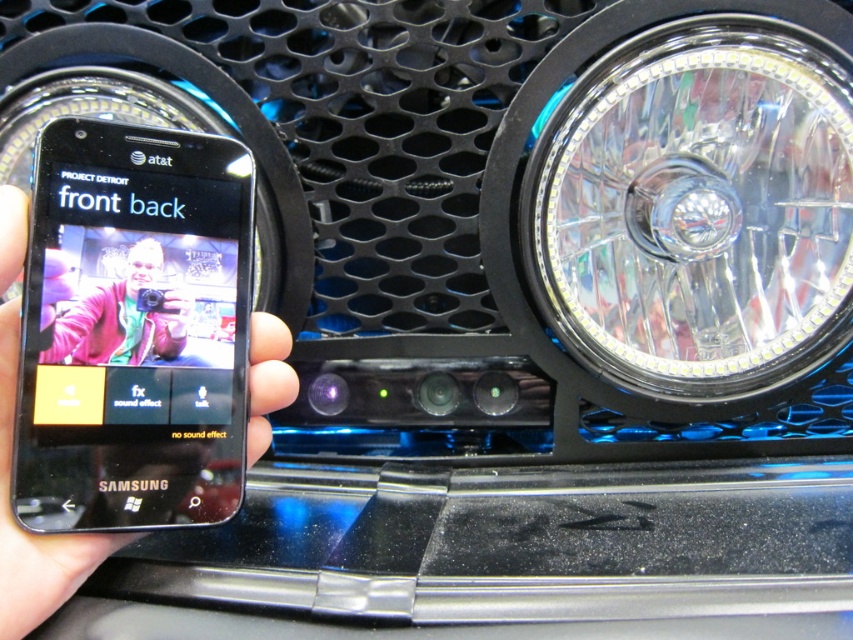
You are a car designer reviewing the front grille design. You have a black matte phone at left and a clear glass headlight at right in your view. Which object is bigger in size?

The clear glass headlight at right has a larger size compared to the black matte phone at left, so the clear glass headlight at right is bigger.

You are a car designer reviewing the front grille design. You notice the clear glass headlight at right and the black matte phone at left in the image. Which object has a greater width in the scene?

The clear glass headlight at right has a greater width than the black matte phone at left according to the description.

Consider the image. You are designing a car advertisement and need to ensure the black matte phone at left and the matte pink jacket at center are both visible in the final shot. Given their sizes, which object should be placed closer to the camera to maintain clarity in the photo?

The matte pink jacket at center should be placed closer to the camera because the black matte phone at left is larger in size, so positioning the smaller matte pink jacket closer ensures both objects appear balanced and clear in the photo.